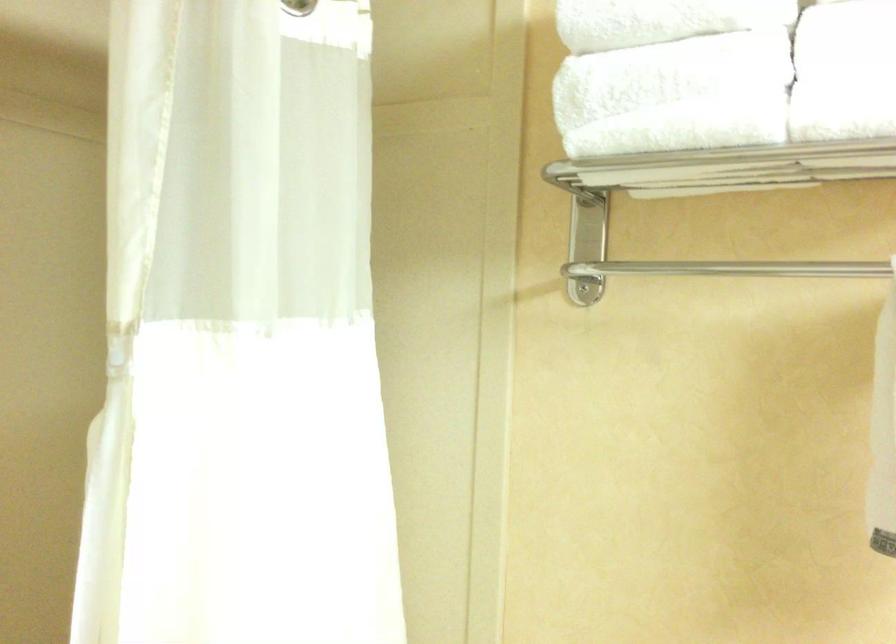
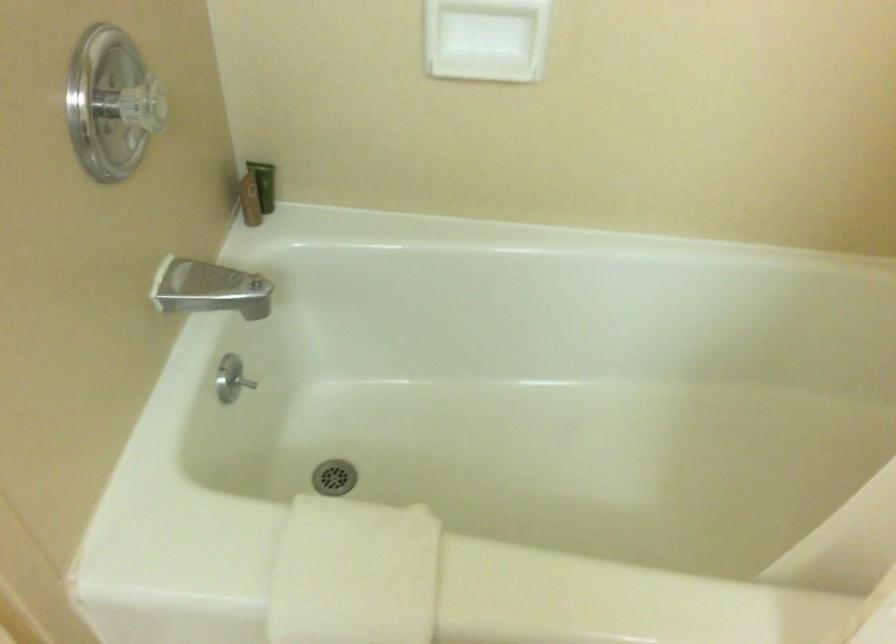
The images are taken continuously from a first-person perspective. In which direction is your viewpoint rotating?

The camera rotated toward left-down.